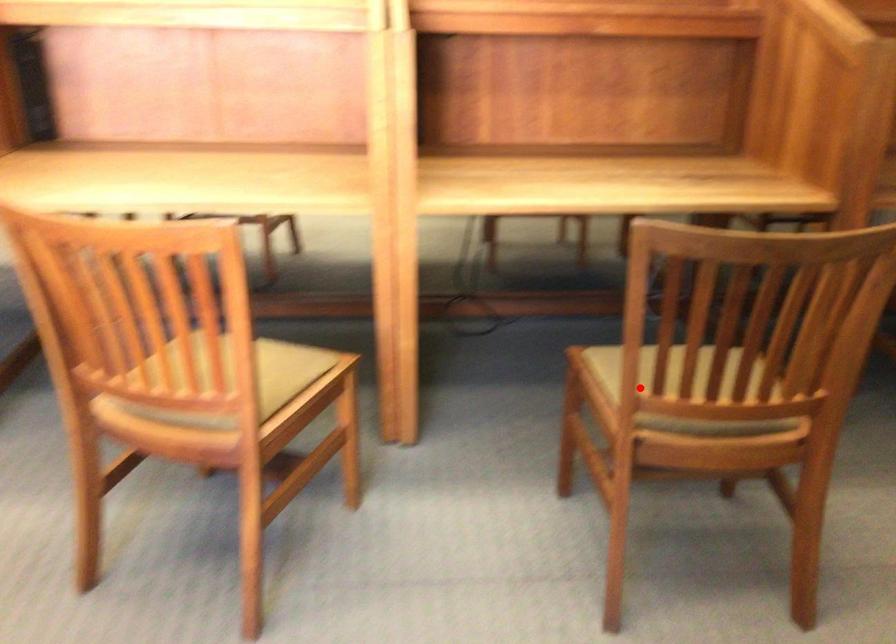
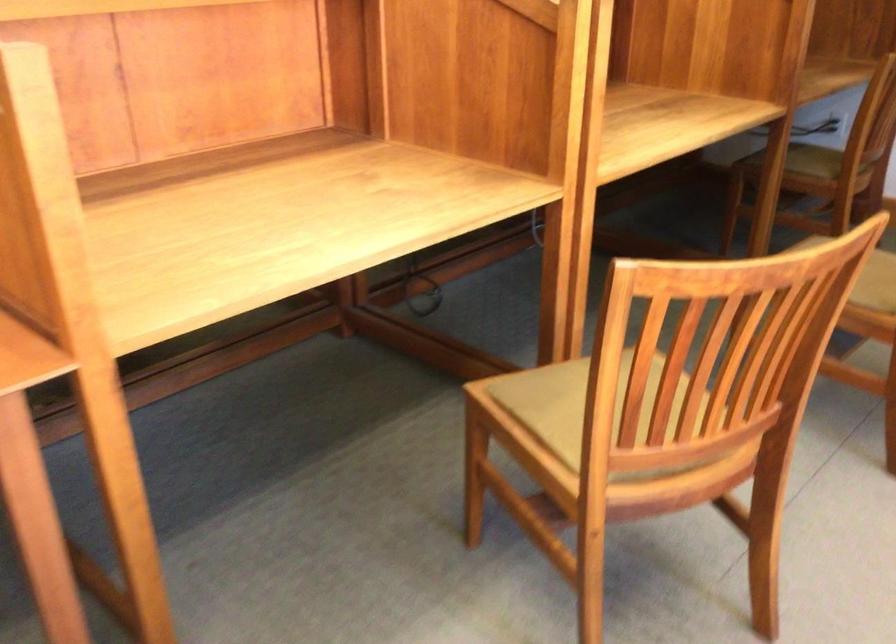
In the second image, find the point that corresponds to the highlighted location in the first image.

(869, 275)